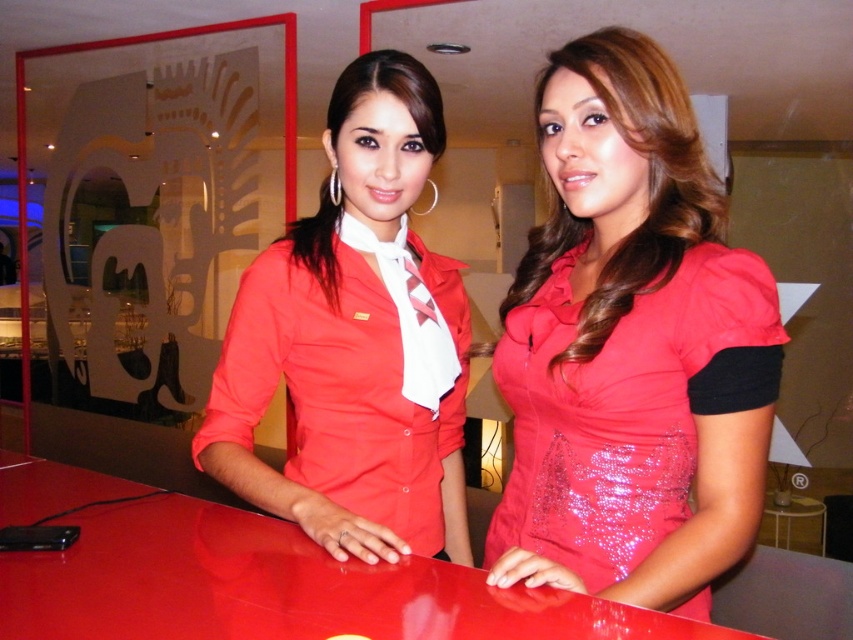
Between point (653, 348) and point (117, 477), which one is positioned in front?

Point (653, 348) is more forward.

Can you confirm if shiny red dress at center is positioned below glossy red table at center?

Actually, shiny red dress at center is above glossy red table at center.

Does point (672, 292) come in front of point (28, 600)?

No, (672, 292) is further to viewer.

This screenshot has width=853, height=640. What are the coordinates of `shiny red dress at center` in the screenshot? It's located at (627, 413).

Does point (444, 380) come closer to viewer compared to point (303, 568)?

That is False.

Is matte red shirt at center shorter than glossy red table at center?

No.

Find the location of a particular element. This screenshot has height=640, width=853. matte red shirt at center is located at coordinates (347, 394).

Where is `matte red shirt at center`? Image resolution: width=853 pixels, height=640 pixels. matte red shirt at center is located at coordinates (347, 394).

Between point (619, 323) and point (335, 436), which one is positioned behind?

Point (335, 436)

Does shiny red dress at center have a greater width compared to matte red shirt at center?

Incorrect, shiny red dress at center's width does not surpass matte red shirt at center's.

Consider the image. Who is more forward, (648, 548) or (345, 241)?

Positioned in front is point (648, 548).

Find the location of a particular element. Image resolution: width=853 pixels, height=640 pixels. shiny red dress at center is located at coordinates (627, 413).